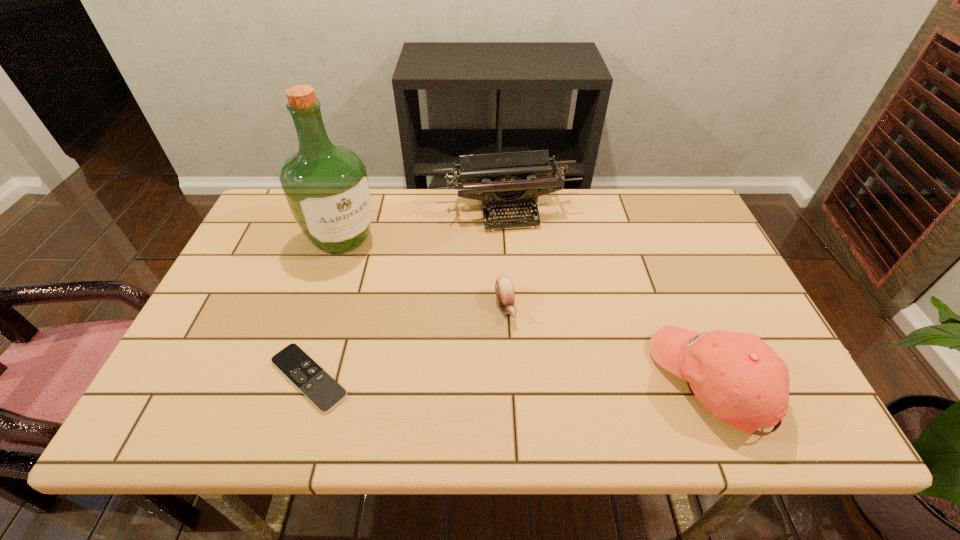
In the image, there is a desktop. Where is `vacant region at the right edge`? The width and height of the screenshot is (960, 540). vacant region at the right edge is located at coordinates (701, 252).

In the image, there is a desktop. What are the coordinates of `free space at the far right corner` in the screenshot? It's located at (673, 229).

You are a GUI agent. You are given a task and a screenshot of the screen. Output one action in this format:
    pyautogui.click(x=<x>, y=<y>)
    Task: Click on the vacant area between the remote control and the baseball cap
    The height and width of the screenshot is (540, 960).
    Given the screenshot: What is the action you would take?
    pyautogui.click(x=511, y=380)

Where is `vacant space that is in between the typewriter and the rightmost object`? The image size is (960, 540). vacant space that is in between the typewriter and the rightmost object is located at coordinates (610, 296).

Find the location of a particular element. The height and width of the screenshot is (540, 960). unoccupied position between the shortest object and the second shortest object is located at coordinates pos(407,342).

The width and height of the screenshot is (960, 540). What are the coordinates of `free space that is in between the baseball cap and the typewriter` in the screenshot? It's located at (610, 296).

Identify the location of unoccupied area between the second shortest object and the baseball cap. The height and width of the screenshot is (540, 960). (610, 344).

The width and height of the screenshot is (960, 540). Identify the location of vacant point located between the fourth tallest object and the tallest object. (423, 273).

This screenshot has width=960, height=540. What are the coordinates of `free area in between the shortest object and the baseball cap` in the screenshot? It's located at (511, 380).

This screenshot has height=540, width=960. I want to click on free space between the rightmost object and the escargot, so click(610, 344).